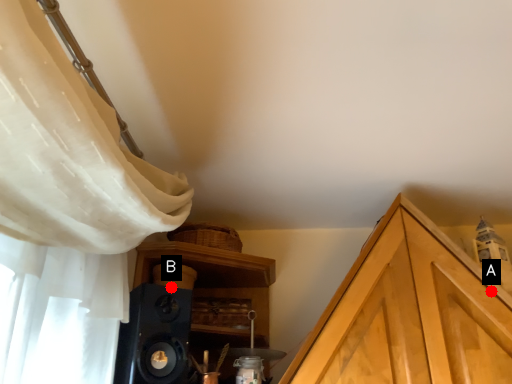
Question: Two points are circled on the image, labeled by A and B beside each circle. Which point appears closest to the camera in this image?

Choices:
 (A) A is closer
 (B) B is closer

Answer: (A)